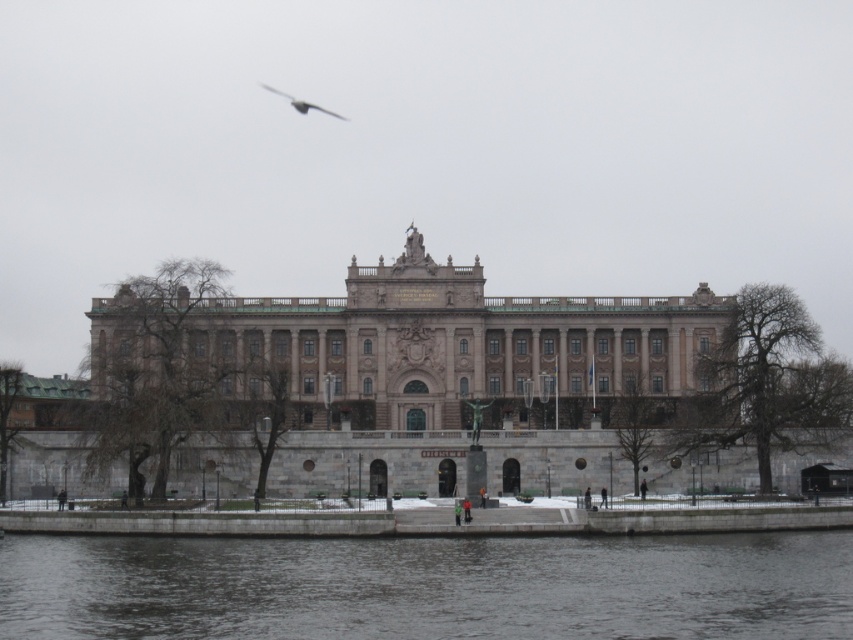
You are an architect designing a new building and want to ensure that the beige stone palace at center and the gray feathered bird at upper center are visible from the main entrance. Based on their sizes, which one would appear larger to someone standing at the entrance?

The beige stone palace at center might be wider than gray feathered bird at upper center, so it would likely appear larger to someone standing at the entrance.

You are a drone operator who needs to fly a drone from the beige stone palace at center to a nearby landmark 175 meters away. Can you safely make the trip without exceeding the drone maximum range of 175 meters?

The beige stone palace at center and the nearby landmark are 175.14 meters apart, which is slightly beyond the drone maximum range of 175 meters. Therefore, the drone cannot safely make the trip.

You are standing on the riverbank and want to enter the beige stone palace at center. According to the scene, which direction should you head relative to the gray concrete river at lower center?

The beige stone palace at center is above the gray concrete river at lower center, so you should head upward from the gray concrete river at lower center to reach the beige stone palace at center.